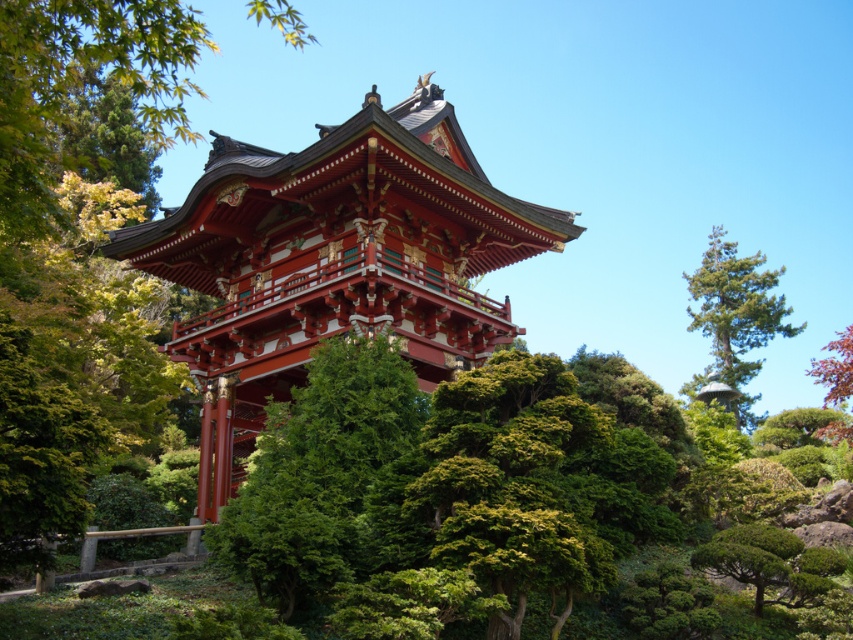
Question: Which object is farther from the camera taking this photo?

Choices:
 (A) shiny lacquered pagoda at center
 (B) green textured tree at center

Answer: (A)

Question: Which object appears farthest from the camera in this image?

Choices:
 (A) green leafy tree at upper left
 (B) shiny red leaves at upper right
 (C) green textured tree at center
 (D) shiny lacquered pagoda at center

Answer: (B)

Question: Which point appears farthest from the camera in this image?

Choices:
 (A) (291, 404)
 (B) (450, 364)
 (C) (772, 298)

Answer: (C)

Question: Is shiny lacquered pagoda at center behind green textured tree at center?

Choices:
 (A) yes
 (B) no

Answer: (A)

Question: Is green textured tree at center further to camera compared to green textured pine tree at right?

Choices:
 (A) no
 (B) yes

Answer: (A)

Question: Is green textured tree at center above shiny red leaves at upper right?

Choices:
 (A) yes
 (B) no

Answer: (B)